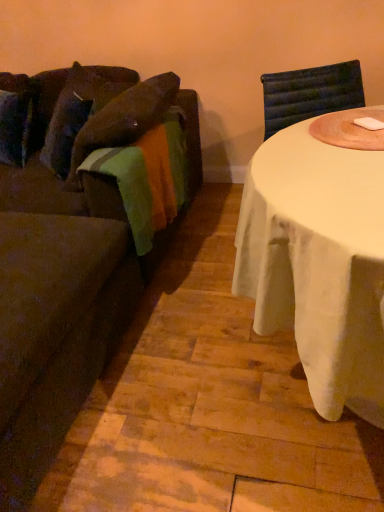
In order to face velvety brown pillow at left, should I rotate leftwards or rightwards?

To face it directly, rotate left by 15.029 degrees.

Describe the element at coordinates (80, 109) in the screenshot. The image size is (384, 512). I see `velvety brown pillow at left` at that location.

Where is `velvety brown pillow at left`? The width and height of the screenshot is (384, 512). velvety brown pillow at left is located at coordinates (80, 109).

What is the approximate width of velvet brown couch at left?

It is 7.62 feet.

At what (x,y) coordinates should I click in order to perform the action: click on velvet brown couch at left. Please return your answer as a coordinate pair (x, y). This screenshot has height=512, width=384. Looking at the image, I should click on [71, 245].

This screenshot has height=512, width=384. Describe the element at coordinates (71, 245) in the screenshot. I see `velvet brown couch at left` at that location.

What are the coordinates of `velvety brown pillow at left` in the screenshot? It's located at (80, 109).

Looking at this image, can you confirm if velvety brown pillow at left is positioned to the right of velvet brown couch at left?

Indeed, velvety brown pillow at left is positioned on the right side of velvet brown couch at left.

Between velvety brown pillow at left and velvet brown couch at left, which one is positioned in front?

velvet brown couch at left is more forward.

Is point (63, 132) farther from viewer compared to point (109, 201)?

Yes, point (63, 132) is farther from viewer.

From the image's perspective, does velvety brown pillow at left appear lower than velvet brown couch at left?

No, from the image's perspective, velvety brown pillow at left is not below velvet brown couch at left.

From a real-world perspective, is velvety brown pillow at left physically below velvet brown couch at left?

Actually, velvety brown pillow at left is physically above velvet brown couch at left in the real world.

Between velvety brown pillow at left and velvet brown couch at left, which one has smaller width?

Thinner between the two is velvety brown pillow at left.

Considering the relative sizes of velvety brown pillow at left and velvet brown couch at left in the image provided, is velvety brown pillow at left shorter than velvet brown couch at left?

Indeed, velvety brown pillow at left has a lesser height compared to velvet brown couch at left.

Is velvety brown pillow at left smaller than velvet brown couch at left?

Indeed, velvety brown pillow at left has a smaller size compared to velvet brown couch at left.

From the picture: Is velvety brown pillow at left not inside velvet brown couch at left?

Actually, velvety brown pillow at left is at least partially inside velvet brown couch at left.

Would you say velvety brown pillow at left is a long distance from velvet brown couch at left?

No, velvety brown pillow at left is not far from velvet brown couch at left.

Is velvety brown pillow at left oriented away from velvet brown couch at left?

Yes.

What are the coordinates of `studio couch in front of the velvety brown pillow at left` in the screenshot? It's located at (71, 245).

Does velvet brown couch at left appear on the left side of velvety brown pillow at left?

Correct, you'll find velvet brown couch at left to the left of velvety brown pillow at left.

Which is behind, velvet brown couch at left or velvety brown pillow at left?

velvety brown pillow at left is further from the camera.

Is point (113, 69) positioned behind point (76, 74)?

Yes.

From the image's perspective, is velvet brown couch at left below velvety brown pillow at left?

Yes, from the image's perspective, velvet brown couch at left is beneath velvety brown pillow at left.

From a real-world perspective, is velvet brown couch at left located beneath velvety brown pillow at left?

Yes, from a real-world perspective, velvet brown couch at left is below velvety brown pillow at left.

Which of these two, velvet brown couch at left or velvety brown pillow at left, is thinner?

Thinner between the two is velvety brown pillow at left.

Is velvet brown couch at left taller or shorter than velvety brown pillow at left?

Considering their sizes, velvet brown couch at left has more height than velvety brown pillow at left.

Does velvet brown couch at left have a larger size compared to velvety brown pillow at left?

Yes, velvet brown couch at left is bigger than velvety brown pillow at left.

Consider the image. Do you think velvet brown couch at left is within velvety brown pillow at left, or outside of it?

velvet brown couch at left is outside velvety brown pillow at left.

Can you see velvet brown couch at left touching velvety brown pillow at left?

There is a gap between velvet brown couch at left and velvety brown pillow at left.

Based on the photo, is velvety brown pillow at left at the back of velvet brown couch at left?

Absolutely, velvet brown couch at left is directed away from velvety brown pillow at left.

This screenshot has height=512, width=384. I want to click on pillow on the right of velvet brown couch at left, so click(80, 109).

You are a GUI agent. You are given a task and a screenshot of the screen. Output one action in this format:
    pyautogui.click(x=<x>, y=<y>)
    Task: Click on the pillow above the velvet brown couch at left (from the image's perspective)
    
    Given the screenshot: What is the action you would take?
    pyautogui.click(x=80, y=109)

Identify the location of studio couch below the velvety brown pillow at left (from a real-world perspective). The image size is (384, 512). (71, 245).